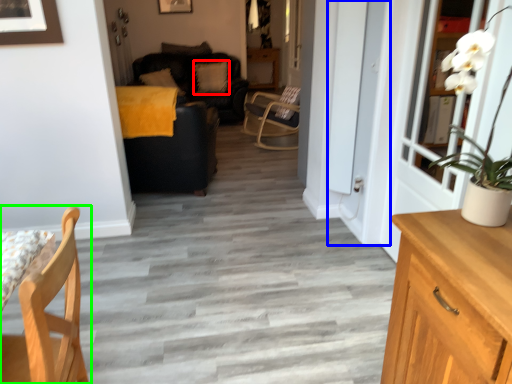
Question: Which object is the closest to the pillow (highlighted by a red box)? Choose among these: screen door (highlighted by a blue box) or chair (highlighted by a green box).

Choices:
 (A) screen door
 (B) chair

Answer: (A)